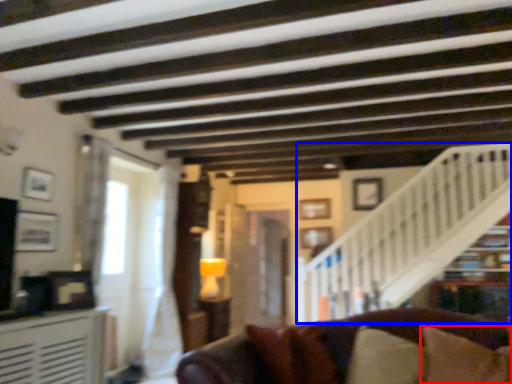
Question: Which of the following is the closest to the observer, pillow (highlighted by a red box) or stairwell (highlighted by a blue box)?

Choices:
 (A) pillow
 (B) stairwell

Answer: (A)